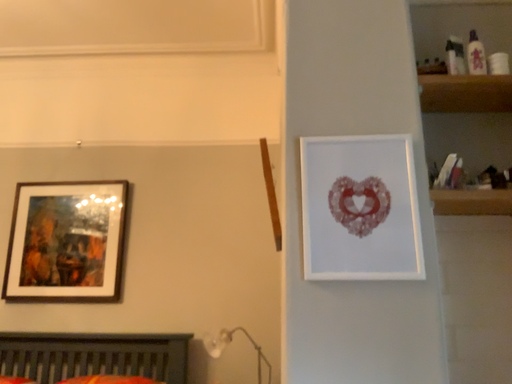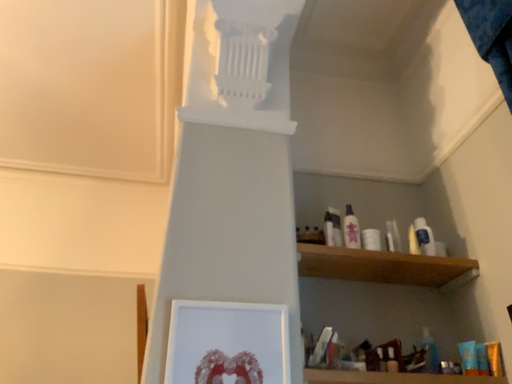
Question: Which way did the camera rotate in the video?

Choices:
 (A) rotated downward
 (B) rotated upward

Answer: (B)